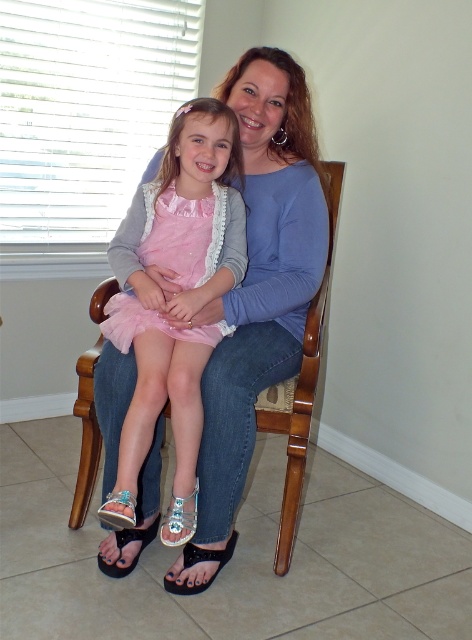
Is black flip-flop at lower center smaller than shiny metallic sandal at lower left?

No.

Can you confirm if black flip-flop at lower center is positioned below shiny metallic sandal at lower left?

Yes.

Is point (118, 536) positioned before point (108, 499)?

That is False.

Locate an element on the screen. black flip-flop at lower center is located at coordinates point(126,544).

Between point (85, 512) and point (160, 540), which one is positioned behind?

Point (85, 512)

Is point (98, 460) positioned before point (187, 536)?

No, it is behind (187, 536).

Locate an element on the screen. wooden armchair at center is located at coordinates (301, 392).

Which is more to the left, pink tulle dress at center or black fabric sandal at lower center?

From the viewer's perspective, pink tulle dress at center appears more on the left side.

Between point (143, 394) and point (185, 582), which one is positioned in front?

Point (143, 394) is more forward.

Between point (151, 288) and point (225, 550), which one is positioned behind?

Point (225, 550)

The height and width of the screenshot is (640, 472). In order to click on pink tulle dress at center in this screenshot , I will do `click(177, 282)`.